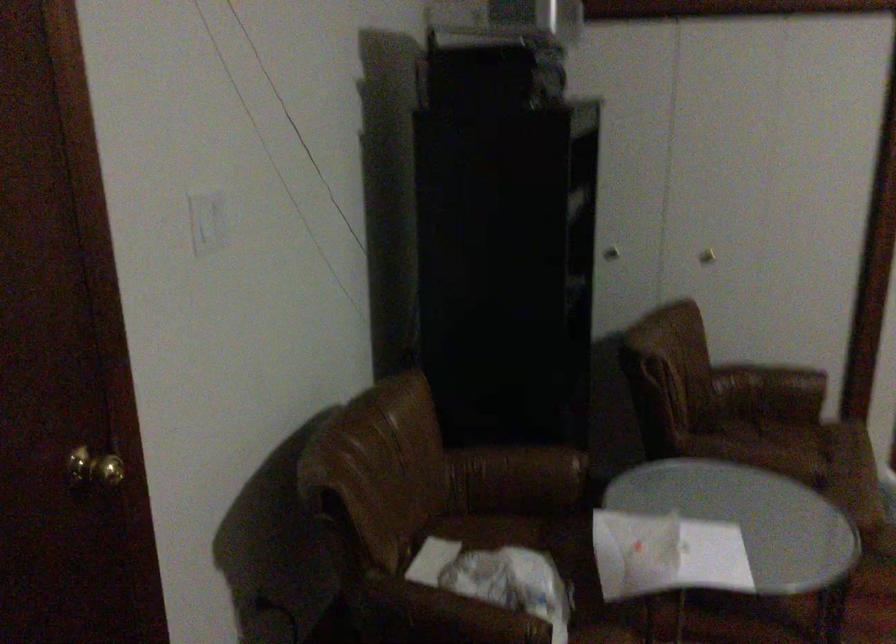
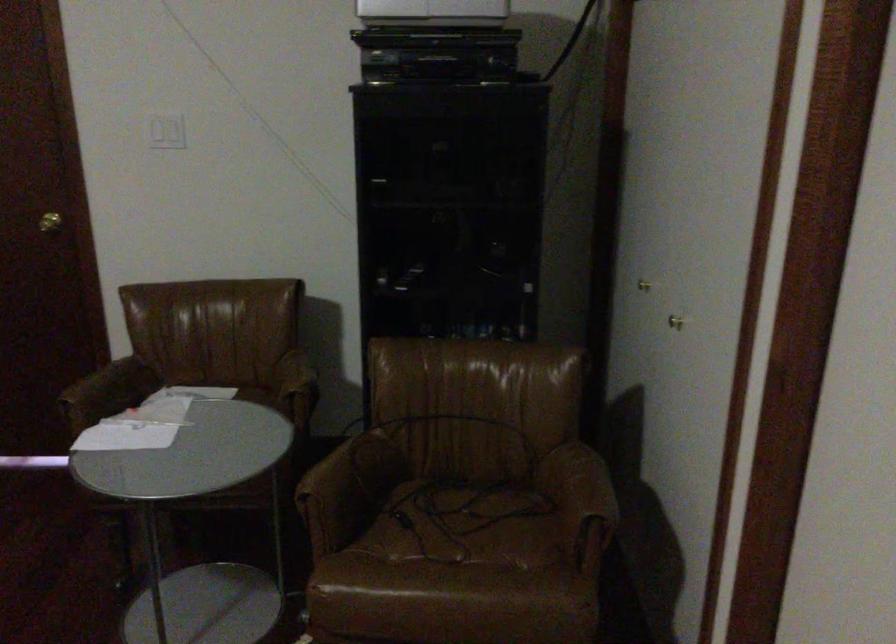
In the second image, find the point that corresponds to point 805,484 in the first image.

(312, 513)